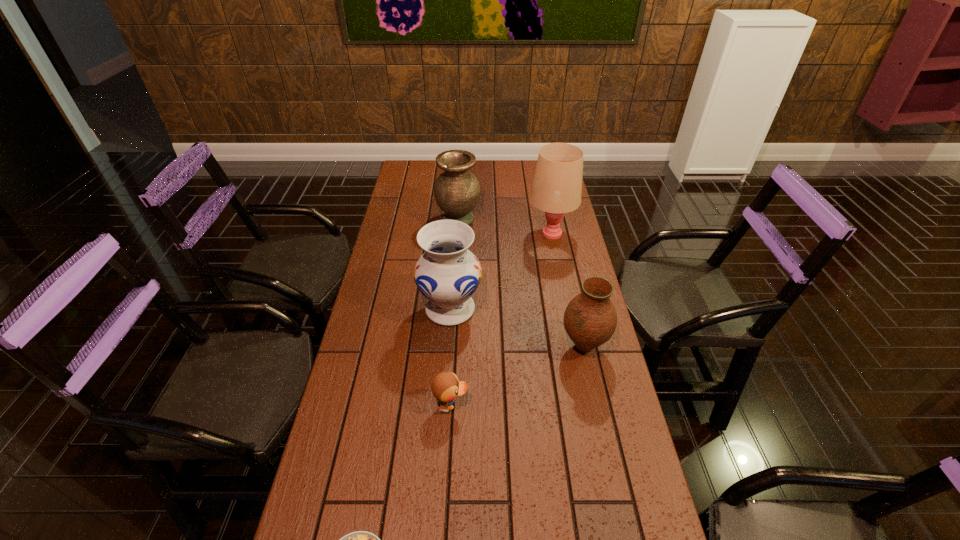
Choose which object is the fourth nearest neighbor to the rightmost vase. Please provide its 2D coordinates. Your answer should be formatted as a tuple, i.e. [(x, y)], where the tuple contains the x and y coordinates of a point satisfying the conditions above.

[(457, 191)]

Identify the location of the fourth closest object relative to the rightmost vase. This screenshot has height=540, width=960. (457, 191).

At what (x,y) coordinates should I click in order to perform the action: click on vase that can be found as the second closest to the rightmost vase. Please return your answer as a coordinate pair (x, y). This screenshot has height=540, width=960. Looking at the image, I should click on (457, 191).

Choose which vase is the third nearest neighbor to the duck. Please provide its 2D coordinates. Your answer should be formatted as a tuple, i.e. [(x, y)], where the tuple contains the x and y coordinates of a point satisfying the conditions above.

[(457, 191)]

The height and width of the screenshot is (540, 960). Identify the location of free spot that satisfies the following two spatial constraints: 1. on the front side of the rightmost vase; 2. on the right side of the lampshade. (574, 347).